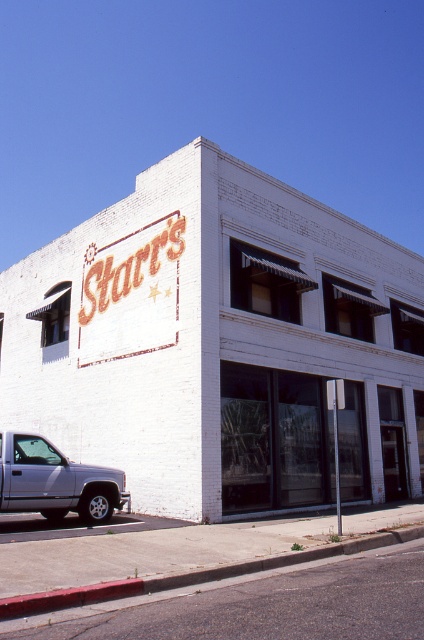
You are standing at the center of the image looking towards the building. If you were to walk straight towards the silver metallic truck at lower left, would you need to move to your left or right to avoid the red curb painted near the edge of the street?

Since the silver metallic truck at lower left is positioned at point (55,481), you would need to move to your right to avoid the red curb painted near the edge of the street.

Where is the white brick building at center located in the image?

The white brick building at center is located at point (220, 342).